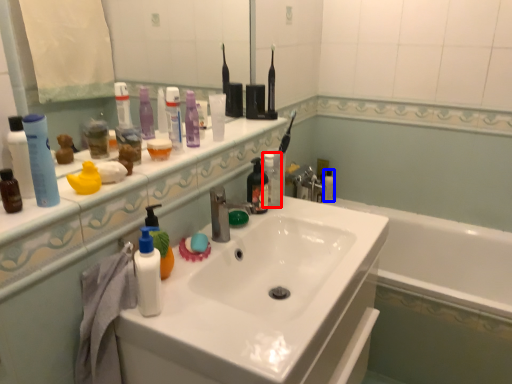
Question: Which object appears closest to the camera in this image, toiletry (highlighted by a red box) or mouthwash (highlighted by a blue box)?

Choices:
 (A) toiletry
 (B) mouthwash

Answer: (A)